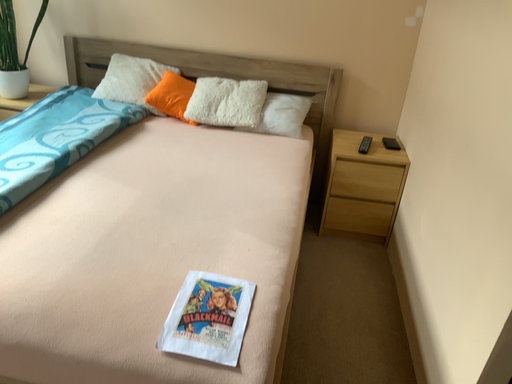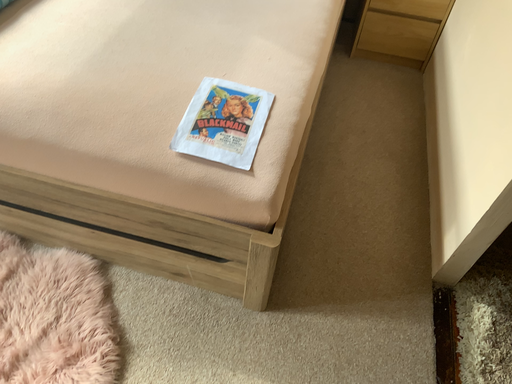
Question: How did the camera likely rotate when shooting the video?

Choices:
 (A) rotated downward
 (B) rotated upward

Answer: (A)